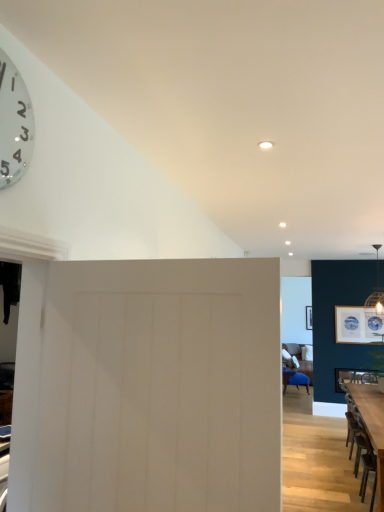
Question: From their relative heights in the image, would you say matte white picture frame at upper right is taller or shorter than white matte door at center?

Choices:
 (A) short
 (B) tall

Answer: (A)

Question: Does point (362, 323) appear closer or farther from the camera than point (122, 420)?

Choices:
 (A) farther
 (B) closer

Answer: (A)

Question: Which object is positioned closest to the metallic silver clock at upper left?

Choices:
 (A) wooden table at lower right
 (B) white matte door at center
 (C) matte white picture frame at upper right

Answer: (B)

Question: Estimate the real-world distances between objects in this image. Which object is farther from the white matte door at center?

Choices:
 (A) metallic silver clock at upper left
 (B) wooden table at lower right
 (C) matte white picture frame at upper right

Answer: (C)